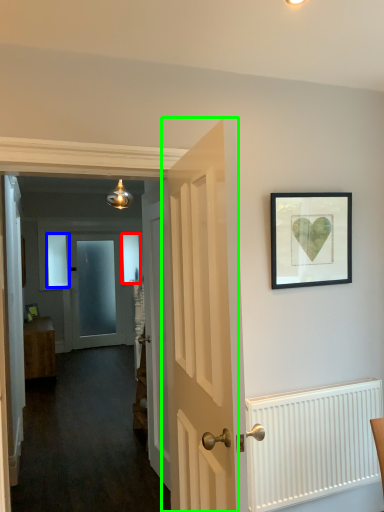
Question: Considering the real-world distances, which object is closest to window (highlighted by a red box)? window (highlighted by a blue box) or door (highlighted by a green box).

Choices:
 (A) window
 (B) door

Answer: (A)